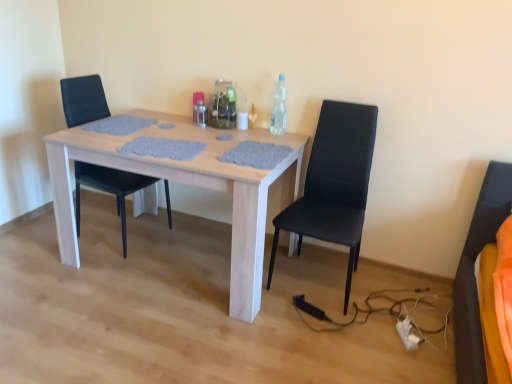
Image resolution: width=512 pixels, height=384 pixels. Identify the location of free point behind white fabric extension cord at lower right. coord(390,314).